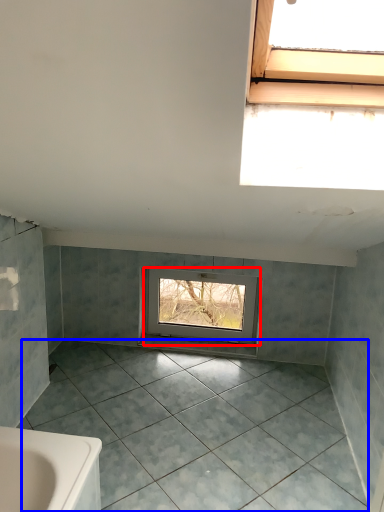
Question: Which point is closer to the camera, window (highlighted by a red box) or ceramic tile (highlighted by a blue box)?

Choices:
 (A) window
 (B) ceramic tile

Answer: (B)